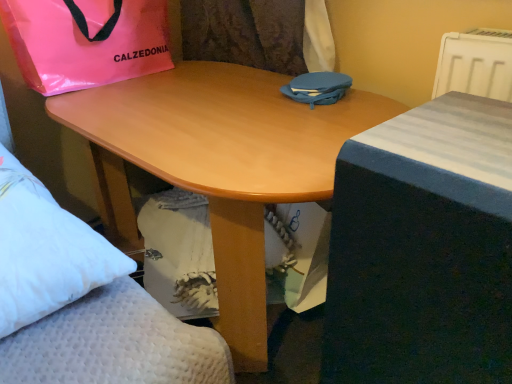
Where is `space that is in front of blue fabric bag at center, placed as the 1th bag when sorted from right to left`? space that is in front of blue fabric bag at center, placed as the 1th bag when sorted from right to left is located at coordinates (324, 115).